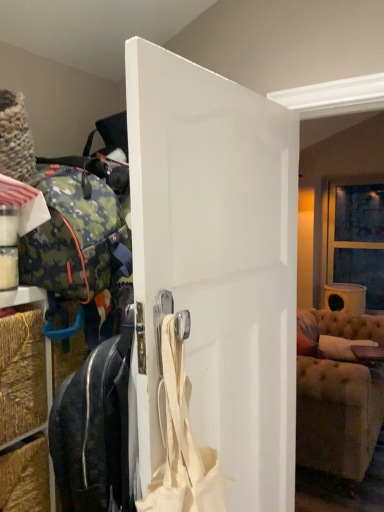
Question: From a real-world perspective, does clear glass window at upper right sit lower than camo fabric backpack at left, which is counted as the 1th luggage and bags, starting from the top?

Choices:
 (A) no
 (B) yes

Answer: (B)

Question: Considering the relative positions of clear glass window at upper right and camo fabric backpack at left, the 2th luggage and bags ordered from the bottom, in the image provided, is clear glass window at upper right to the left of camo fabric backpack at left, the 2th luggage and bags ordered from the bottom, from the viewer's perspective?

Choices:
 (A) yes
 (B) no

Answer: (B)

Question: Can you see clear glass window at upper right touching camo fabric backpack at left, which is counted as the 1th luggage and bags, starting from the top?

Choices:
 (A) no
 (B) yes

Answer: (A)

Question: Considering the relative positions of clear glass window at upper right and camo fabric backpack at left, which is counted as the 1th luggage and bags, starting from the top, in the image provided, is clear glass window at upper right in front of camo fabric backpack at left, which is counted as the 1th luggage and bags, starting from the top,?

Choices:
 (A) no
 (B) yes

Answer: (A)

Question: From the image's perspective, does clear glass window at upper right appear higher than camo fabric backpack at left, which is counted as the 1th luggage and bags, starting from the top?

Choices:
 (A) no
 (B) yes

Answer: (B)

Question: Is clear glass window at upper right located outside camo fabric backpack at left, which is counted as the 1th luggage and bags, starting from the top?

Choices:
 (A) no
 (B) yes

Answer: (B)

Question: Is white matte door at center looking in the opposite direction of camo fabric backpack at left, which is counted as the 1th luggage and bags, starting from the top?

Choices:
 (A) yes
 (B) no

Answer: (A)

Question: Could you tell me if white matte door at center is facing camo fabric backpack at left, the 2th luggage and bags ordered from the bottom?

Choices:
 (A) no
 (B) yes

Answer: (B)

Question: Is white matte door at center closer to the viewer compared to camo fabric backpack at left, the 2th luggage and bags ordered from the bottom?

Choices:
 (A) no
 (B) yes

Answer: (B)

Question: Does white matte door at center lie behind camo fabric backpack at left, which is counted as the 1th luggage and bags, starting from the top?

Choices:
 (A) no
 (B) yes

Answer: (A)

Question: Is white matte door at center shorter than camo fabric backpack at left, which is counted as the 1th luggage and bags, starting from the top?

Choices:
 (A) yes
 (B) no

Answer: (B)

Question: Is white matte door at center smaller than camo fabric backpack at left, which is counted as the 1th luggage and bags, starting from the top?

Choices:
 (A) yes
 (B) no

Answer: (A)

Question: Could you tell me if black leather suitcase at center, which appears as the 2th luggage and bags when viewed from the top, is facing beige fabric shoulder bag at center?

Choices:
 (A) no
 (B) yes

Answer: (B)